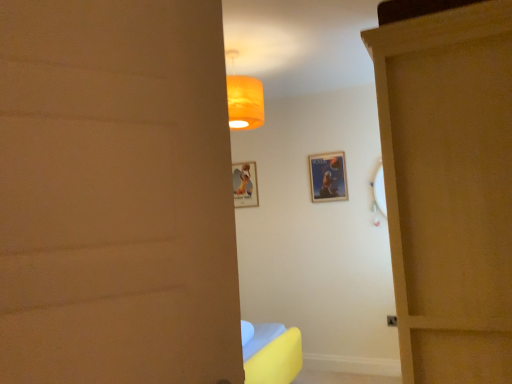
Question: Would you consider metallic silver poster at center, positioned as the 1th picture frame in front-to-back order, to be distant from matte paper picture frame at center, which is counted as the first picture frame, starting from the left?

Choices:
 (A) yes
 (B) no

Answer: (B)

Question: Does metallic silver poster at center, which appears as the 2th picture frame when viewed from the back, lie in front of matte paper picture frame at center, which is counted as the first picture frame, starting from the left?

Choices:
 (A) no
 (B) yes

Answer: (B)

Question: Is metallic silver poster at center, marked as the first picture frame in a right-to-left arrangement, located outside matte paper picture frame at center, which appears as the 2th picture frame when viewed from the front?

Choices:
 (A) yes
 (B) no

Answer: (A)

Question: From the image's perspective, is metallic silver poster at center, which appears as the 2th picture frame when viewed from the back, over matte paper picture frame at center, which is counted as the first picture frame, starting from the left?

Choices:
 (A) no
 (B) yes

Answer: (B)

Question: Considering the relative sizes of metallic silver poster at center, which is counted as the second picture frame, starting from the left, and matte paper picture frame at center, which is counted as the second picture frame, starting from the right, in the image provided, is metallic silver poster at center, which is counted as the second picture frame, starting from the left, shorter than matte paper picture frame at center, which is counted as the second picture frame, starting from the right,?

Choices:
 (A) yes
 (B) no

Answer: (A)

Question: Is metallic silver poster at center, positioned as the 1th picture frame in front-to-back order, facing towards matte paper picture frame at center, which appears as the 2th picture frame when viewed from the front?

Choices:
 (A) yes
 (B) no

Answer: (B)

Question: Considering the relative positions of matte paper picture frame at center, which appears as the 2th picture frame when viewed from the front, and wooden door at right in the image provided, is matte paper picture frame at center, which appears as the 2th picture frame when viewed from the front, behind wooden door at right?

Choices:
 (A) yes
 (B) no

Answer: (A)

Question: From a real-world perspective, is matte paper picture frame at center, which is counted as the first picture frame, starting from the left, beneath wooden door at right?

Choices:
 (A) yes
 (B) no

Answer: (B)

Question: Is matte paper picture frame at center, which is counted as the first picture frame, starting from the left, at the left side of wooden door at right?

Choices:
 (A) yes
 (B) no

Answer: (A)

Question: Does matte paper picture frame at center, which is counted as the second picture frame, starting from the right, have a greater height compared to wooden door at right?

Choices:
 (A) yes
 (B) no

Answer: (B)

Question: Are matte paper picture frame at center, which is counted as the second picture frame, starting from the right, and wooden door at right making contact?

Choices:
 (A) no
 (B) yes

Answer: (A)

Question: Is wooden door at right located within matte paper picture frame at center, which is counted as the second picture frame, starting from the right?

Choices:
 (A) yes
 (B) no

Answer: (B)

Question: Is wooden door at right at the right side of matte paper picture frame at center, which appears as the 2th picture frame when viewed from the front?

Choices:
 (A) yes
 (B) no

Answer: (A)